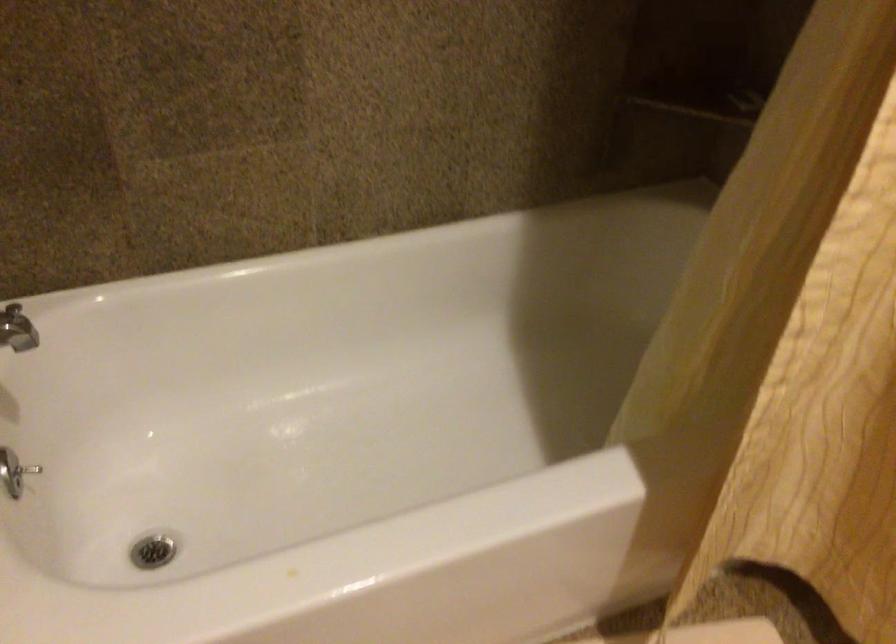
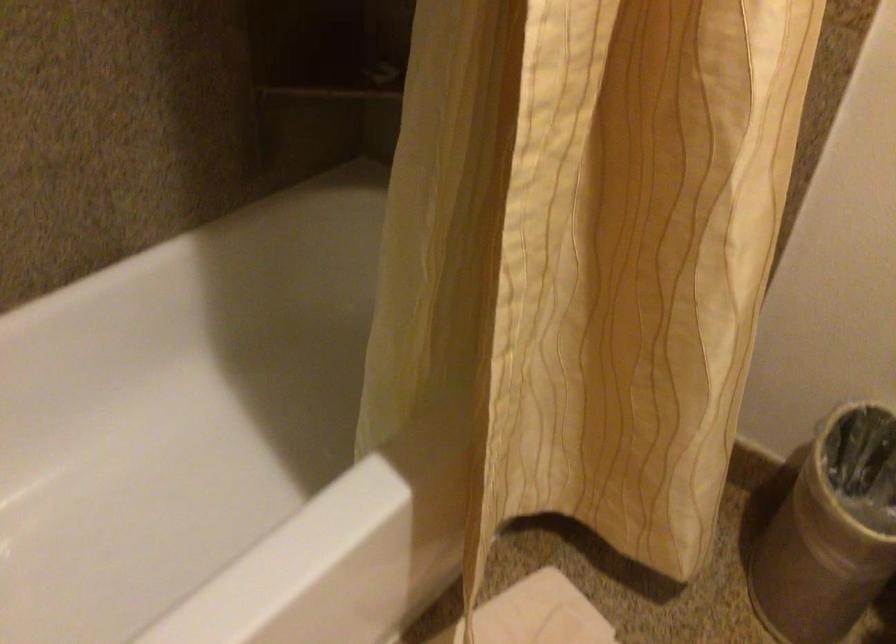
Question: The camera is either moving clockwise (left) or counter-clockwise (right) around the object. The first image is from the beginning of the video and the second image is from the end. Is the camera moving left or right when shooting the video?

Choices:
 (A) Left
 (B) Right

Answer: (A)